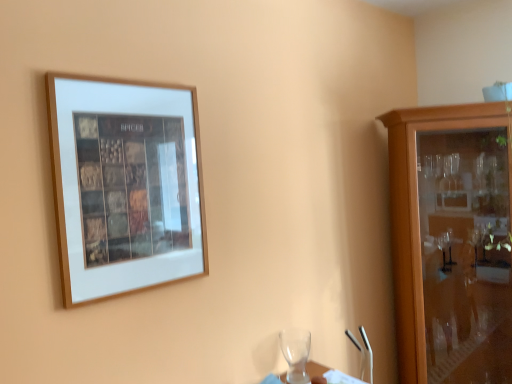
This screenshot has width=512, height=384. Find the location of `wooden picture frame at upper left`. wooden picture frame at upper left is located at coordinates (125, 185).

What do you see at coordinates (125, 185) in the screenshot?
I see `wooden picture frame at upper left` at bounding box center [125, 185].

Describe the element at coordinates (452, 241) in the screenshot. Image resolution: width=512 pixels, height=384 pixels. I see `wooden cabinet at right` at that location.

Locate an element on the screen. The height and width of the screenshot is (384, 512). wooden cabinet at right is located at coordinates [x=452, y=241].

Find the location of a particular element. transparent glass wine glass at lower center is located at coordinates (296, 353).

The image size is (512, 384). I want to click on wooden picture frame at upper left, so click(x=125, y=185).

Is wooden cabinet at right situated inside wooden picture frame at upper left or outside?

wooden cabinet at right is located beyond the bounds of wooden picture frame at upper left.

From the image's perspective, would you say wooden cabinet at right is shown under wooden picture frame at upper left?

Indeed, from the image's perspective, wooden cabinet at right is shown beneath wooden picture frame at upper left.

Is wooden cabinet at right oriented away from wooden picture frame at upper left?

No, wooden picture frame at upper left is not at the back of wooden cabinet at right.

In order to click on cabinetry behind the transparent glass wine glass at lower center in this screenshot , I will do `click(452, 241)`.

Considering the sizes of objects transparent glass wine glass at lower center and wooden cabinet at right in the image provided, who is wider, transparent glass wine glass at lower center or wooden cabinet at right?

wooden cabinet at right.

Looking at this image, measure the distance from transparent glass wine glass at lower center to wooden cabinet at right.

transparent glass wine glass at lower center and wooden cabinet at right are 37.16 inches apart.

Considering the sizes of wooden cabinet at right and transparent glass wine glass at lower center in the image, is wooden cabinet at right taller or shorter than transparent glass wine glass at lower center?

Considering their sizes, wooden cabinet at right has more height than transparent glass wine glass at lower center.

Is wooden cabinet at right positioned before transparent glass wine glass at lower center?

No.

Looking at this image, in terms of width, does wooden cabinet at right look wider or thinner when compared to transparent glass wine glass at lower center?

Clearly, wooden cabinet at right has more width compared to transparent glass wine glass at lower center.

From the image's perspective, which one is positioned higher, wooden cabinet at right or transparent glass wine glass at lower center?

From the image's view, wooden cabinet at right is above.

Is transparent glass wine glass at lower center oriented away from wooden picture frame at upper left?

transparent glass wine glass at lower center is not turned away from wooden picture frame at upper left.

From the image's perspective, is transparent glass wine glass at lower center located above or below wooden picture frame at upper left?

Based on their image positions, transparent glass wine glass at lower center is located beneath wooden picture frame at upper left.

In terms of width, does transparent glass wine glass at lower center look wider or thinner when compared to wooden picture frame at upper left?

Clearly, transparent glass wine glass at lower center has more width compared to wooden picture frame at upper left.

Is wooden picture frame at upper left completely or partially inside transparent glass wine glass at lower center?

That's incorrect, wooden picture frame at upper left is not inside transparent glass wine glass at lower center.

Which object is thinner, wooden picture frame at upper left or wooden cabinet at right?

With smaller width is wooden picture frame at upper left.

Is wooden picture frame at upper left not close to wooden cabinet at right?

Indeed, wooden picture frame at upper left is not near wooden cabinet at right.

Is wooden picture frame at upper left looking in the opposite direction of wooden cabinet at right?

That's not correct — wooden picture frame at upper left is not looking away from wooden cabinet at right.

Consider the image. From the image's perspective, is wooden picture frame at upper left located above or below wooden cabinet at right?

wooden picture frame at upper left is above wooden cabinet at right.

Which is in front, wooden picture frame at upper left or transparent glass wine glass at lower center?

wooden picture frame at upper left.

The width and height of the screenshot is (512, 384). What are the coordinates of `picture frame that appears on the left of transparent glass wine glass at lower center` in the screenshot? It's located at (125, 185).

Considering the sizes of wooden picture frame at upper left and transparent glass wine glass at lower center in the image, is wooden picture frame at upper left wider or thinner than transparent glass wine glass at lower center?

Considering their sizes, wooden picture frame at upper left looks slimmer than transparent glass wine glass at lower center.

The height and width of the screenshot is (384, 512). In order to click on cabinetry below the wooden picture frame at upper left (from the image's perspective) in this screenshot , I will do `click(452, 241)`.

Identify the location of cabinetry behind the transparent glass wine glass at lower center. Image resolution: width=512 pixels, height=384 pixels. (452, 241).

Looking at the image, which one is located further to transparent glass wine glass at lower center, wooden picture frame at upper left or wooden cabinet at right?

The object further to transparent glass wine glass at lower center is wooden picture frame at upper left.

Based on their spatial positions, is transparent glass wine glass at lower center or wooden cabinet at right closer to wooden picture frame at upper left?

The object closer to wooden picture frame at upper left is transparent glass wine glass at lower center.

When comparing their distances from wooden picture frame at upper left, does wooden cabinet at right or transparent glass wine glass at lower center seem closer?

transparent glass wine glass at lower center is closer to wooden picture frame at upper left.

In the scene shown: Which object lies nearer to the anchor point transparent glass wine glass at lower center, wooden cabinet at right or wooden picture frame at upper left?

Among the two, wooden cabinet at right is located nearer to transparent glass wine glass at lower center.

From the image, which object appears to be farther from wooden cabinet at right, wooden picture frame at upper left or transparent glass wine glass at lower center?

Based on the image, wooden picture frame at upper left appears to be further to wooden cabinet at right.

When comparing their distances from wooden cabinet at right, does transparent glass wine glass at lower center or wooden picture frame at upper left seem closer?

transparent glass wine glass at lower center.

Where is `wine glass situated between wooden picture frame at upper left and wooden cabinet at right from left to right`? The image size is (512, 384). wine glass situated between wooden picture frame at upper left and wooden cabinet at right from left to right is located at coordinates (296, 353).